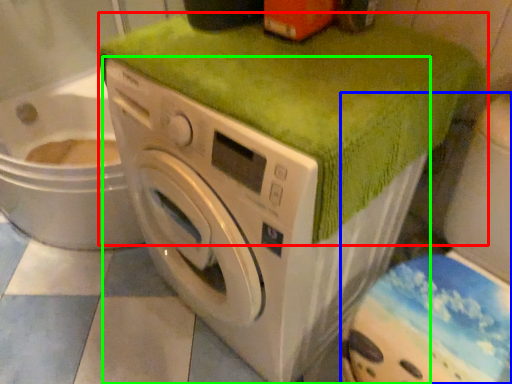
Question: Which is nearer to the bath towel (highlighted by a red box)? washer (highlighted by a blue box) or washing machine (highlighted by a green box).

Choices:
 (A) washer
 (B) washing machine

Answer: (B)